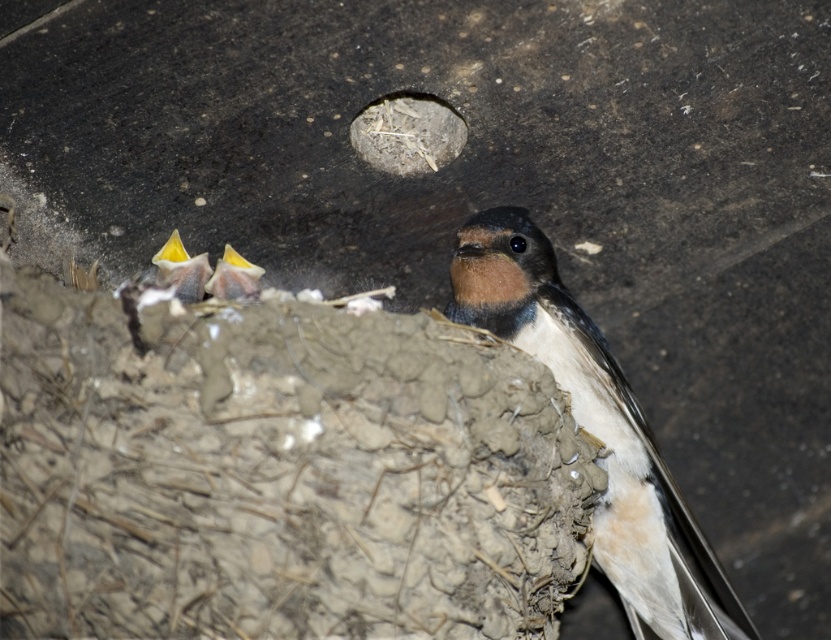
Is point (171, 262) closer to camera compared to point (235, 273)?

No.

From the picture: Is yellow beak at left taller than yellow beak at center?

Yes.

Which is behind, point (166, 243) or point (238, 268)?

The point (166, 243) is behind.

This screenshot has height=640, width=831. I want to click on yellow beak at left, so click(x=182, y=269).

Is brown feathered bird at center smaller than yellow beak at left?

Actually, brown feathered bird at center might be larger than yellow beak at left.

You are a GUI agent. You are given a task and a screenshot of the screen. Output one action in this format:
    pyautogui.click(x=<x>, y=<y>)
    Task: Click on the brown feathered bird at center
    
    Given the screenshot: What is the action you would take?
    pyautogui.click(x=597, y=429)

Based on the photo, is brown feathered bird at center further to camera compared to yellow beak at center?

→ Yes.

Which is in front, point (662, 616) or point (257, 273)?

Point (257, 273) is in front.

Between point (647, 432) and point (259, 276), which one is positioned in front?

Point (259, 276) is more forward.

Find the location of a particular element. brown feathered bird at center is located at coordinates (597, 429).